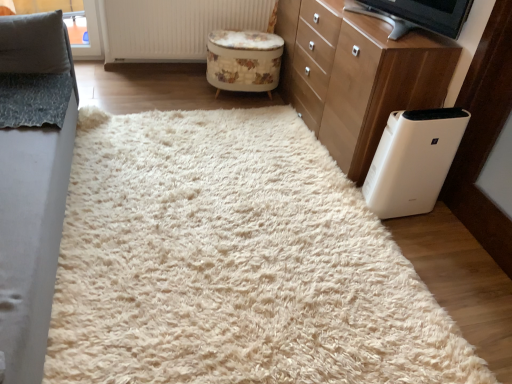
Question: Visually, is white textured radiator at upper center positioned to the left or to the right of white plastic air purifier at lower right?

Choices:
 (A) left
 (B) right

Answer: (A)

Question: Based on their sizes in the image, would you say white textured radiator at upper center is bigger or smaller than white plastic air purifier at lower right?

Choices:
 (A) small
 (B) big

Answer: (B)

Question: Which is farther from the white textured radiator at upper center?

Choices:
 (A) gray fabric pillow at upper left
 (B) gray fabric couch at left
 (C) white plastic air purifier at lower right
 (D) white fluffy rug at center
 (E) white plastic tv at upper right

Answer: (C)

Question: Which object is positioned closest to the floral-patterned fabric stool at center?

Choices:
 (A) gray fabric pillow at upper left
 (B) gray fabric couch at left
 (C) white textured radiator at upper center
 (D) white wood chest of drawers at right
 (E) white fluffy rug at center

Answer: (C)